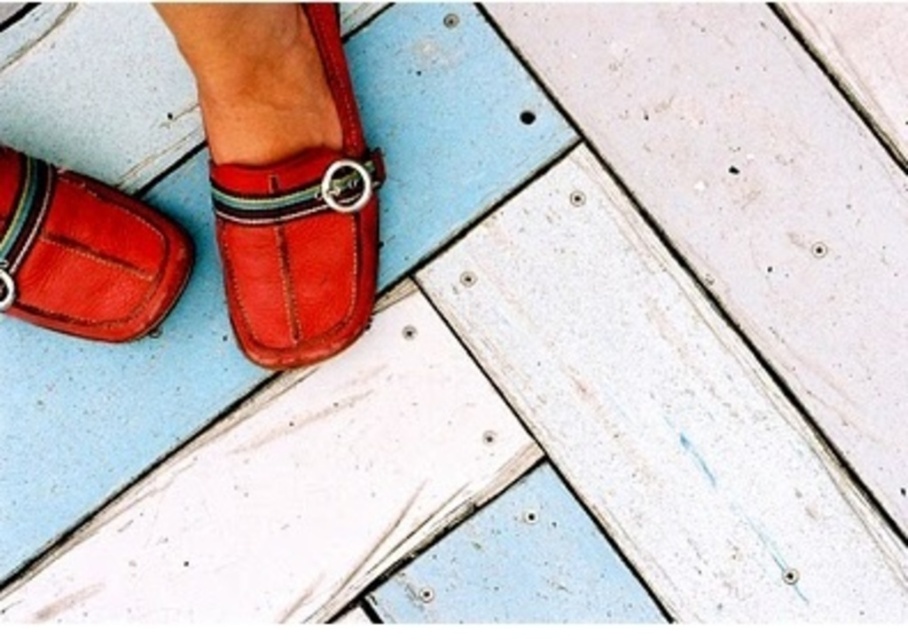
You are standing on the wooden floor and see the leather loafer at center and the matte leather shoe at lower left. Which shoe is located to the right of the other?

The leather loafer at center is positioned on the right side of the matte leather shoe at lower left.

You are a shoemaker examining two shoes in the image. The leather loafer at center and the matte leather shoe at lower left. Which one do you think requires more material to make?

The leather loafer at center requires more material because it is bigger than the matte leather shoe at lower left.

Consider the image. You are a shoemaker observing the leather loafer at center and the matte leather shoe at lower left. Which shoe has a higher heel?

The leather loafer at center has a greater height compared to the matte leather shoe at lower left, so the leather loafer at center has a higher heel.